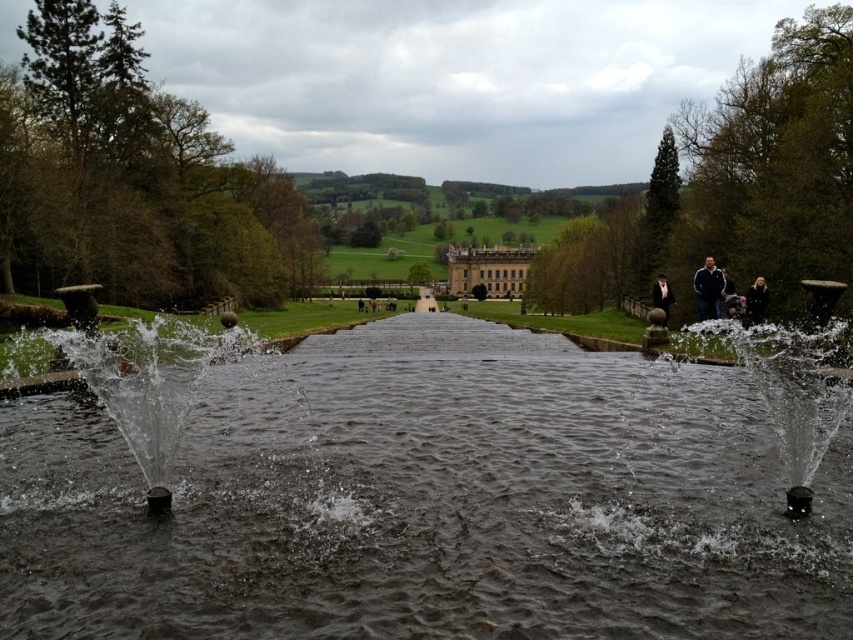
Looking at this image, is dark blue jacket at upper right smaller than black fabric person at right?

Correct, dark blue jacket at upper right occupies less space than black fabric person at right.

Is dark blue jacket at upper right wider than black fabric person at right?

In fact, dark blue jacket at upper right might be narrower than black fabric person at right.

Who is more forward, (x=692, y=284) or (x=749, y=323)?

Point (x=749, y=323) is more forward.

Where is `dark blue jacket at upper right`? This screenshot has width=853, height=640. dark blue jacket at upper right is located at coordinates (708, 289).

Which of these two, metallic water at center or dark blue jacket at upper right, stands taller?

metallic water at center

Is point (213, 394) positioned behind point (712, 282)?

No.

Between point (160, 390) and point (692, 282), which one is positioned in front?

Point (160, 390) is more forward.

You are a GUI agent. You are given a task and a screenshot of the screen. Output one action in this format:
    pyautogui.click(x=<x>, y=<y>)
    Task: Click on the metallic water at center
    
    Given the screenshot: What is the action you would take?
    pyautogui.click(x=154, y=387)

How much distance is there between metallic water at center and black fabric person at right?

A distance of 221.38 feet exists between metallic water at center and black fabric person at right.

Is metallic water at center taller than black fabric person at right?

Yes, metallic water at center is taller than black fabric person at right.

This screenshot has height=640, width=853. What do you see at coordinates (154, 387) in the screenshot?
I see `metallic water at center` at bounding box center [154, 387].

Locate an element on the screen. The width and height of the screenshot is (853, 640). metallic water at center is located at coordinates (154, 387).